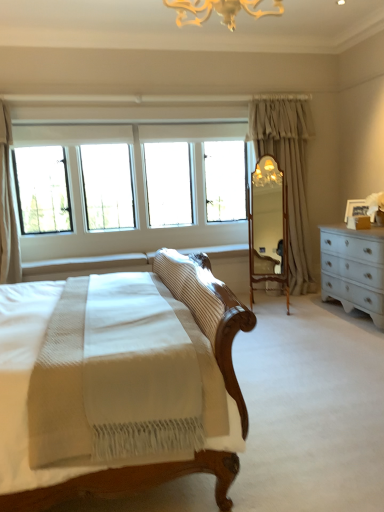
Question: From the image's perspective, relative to wooden mirror at center, is white textured curtain at upper left, which is the second curtain from right to left, above or below?

Choices:
 (A) above
 (B) below

Answer: (A)

Question: In the image, is white textured curtain at upper left, which is the second curtain from right to left, positioned in front of or behind wooden mirror at center?

Choices:
 (A) behind
 (B) front

Answer: (B)

Question: Estimate the real-world distances between objects in this image. Which object is farther from the white textured curtain at upper left, the second curtain viewed from the back?

Choices:
 (A) clear glass windows at upper left
 (B) light beige fabric curtain at center-right, the 1th curtain positioned from the back
 (C) wooden mirror at center

Answer: (B)

Question: Based on their relative distances, which object is nearer to the light beige fabric curtain at center-right, the 1th curtain in the right-to-left sequence?

Choices:
 (A) white textured curtain at upper left, the first curtain from the front
 (B) clear glass windows at upper left
 (C) wooden mirror at center

Answer: (C)